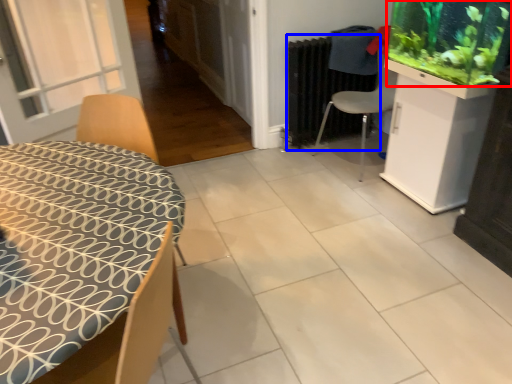
Question: Which object appears farthest to the camera in this image, plant (highlighted by a red box) or radiator (highlighted by a blue box)?

Choices:
 (A) plant
 (B) radiator

Answer: (B)